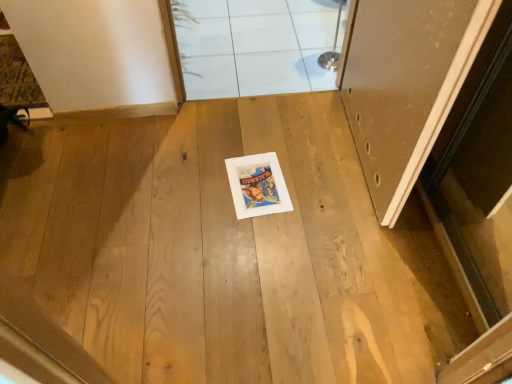
Describe the element at coordinates (406, 85) in the screenshot. I see `matte white door at right` at that location.

The width and height of the screenshot is (512, 384). I want to click on white tile at upper center, so click(254, 46).

In terms of height, does white tile at upper center look taller or shorter compared to white glossy tile at upper center?

white tile at upper center is shorter than white glossy tile at upper center.

From a real-world perspective, relative to white glossy tile at upper center, is white tile at upper center vertically above or below?

white tile at upper center is situated lower than white glossy tile at upper center in the real world.

Based on the photo, is white tile at upper center spatially inside white glossy tile at upper center, or outside of it?

white tile at upper center lies outside white glossy tile at upper center.

Which of these two, white tile at upper center or white glossy tile at upper center, is bigger?

With larger size is white tile at upper center.

Does point (325, 43) appear closer or farther from the camera than point (458, 84)?

Point (325, 43) is positioned farther from the camera compared to point (458, 84).

Based on the photo, does white glossy tile at upper center have a greater height compared to matte white door at right?

No, white glossy tile at upper center is not taller than matte white door at right.

Visually, is white glossy tile at upper center positioned to the left or to the right of matte white door at right?

Clearly, white glossy tile at upper center is on the left of matte white door at right in the image.

Could you tell me if white tile at upper center is facing matte white door at right?

No, white tile at upper center does not turn towards matte white door at right.

Which is correct: white tile at upper center is inside matte white door at right, or outside of it?

white tile at upper center is not inside matte white door at right, it's outside.

Between white tile at upper center and matte white door at right, which one appears on the right side from the viewer's perspective?

matte white door at right is more to the right.

Is white tile at upper center touching matte white door at right?

No, white tile at upper center is not making contact with matte white door at right.

How many degrees apart are the facing directions of matte white door at right and white glossy tile at upper center?

matte white door at right and white glossy tile at upper center are facing 4.18 degrees away from each other.

From the picture: From a real-world perspective, is matte white door at right positioned above or below white glossy tile at upper center?

From a real-world perspective, matte white door at right is physically above white glossy tile at upper center.

Which of these two, matte white door at right or white glossy tile at upper center, stands taller?

matte white door at right is taller.

Which object is positioned more to the right, matte white door at right or white tile at upper center?

matte white door at right.

Considering the positions of points (425, 28) and (270, 17), is point (425, 28) farther from camera compared to point (270, 17)?

No, (425, 28) is closer to viewer.

Can we say matte white door at right lies outside white tile at upper center?

Yes, matte white door at right is located beyond the bounds of white tile at upper center.

In terms of size, does white glossy tile at upper center appear bigger or smaller than white tile at upper center?

white glossy tile at upper center is smaller than white tile at upper center.

Can you tell me how much white glossy tile at upper center and white tile at upper center differ in facing direction?

92.4 degrees separate the facing orientations of white glossy tile at upper center and white tile at upper center.

Is white glossy tile at upper center touching white tile at upper center?

No, white glossy tile at upper center is not in contact with white tile at upper center.

Find the location of a particular element. This screenshot has width=512, height=384. window below the white glossy tile at upper center (from a real-world perspective) is located at coordinates (254, 46).

In the image, there is a white glossy tile at upper center. Where is `window below it (from the image's perspective)`? window below it (from the image's perspective) is located at coordinates (254, 46).

In order to click on tile that is under the matte white door at right (from a real-world perspective) in this screenshot , I will do `click(315, 29)`.

In the scene shown: Looking at the image, which one is located further to matte white door at right, white tile at upper center or white glossy tile at upper center?

The object further to matte white door at right is white glossy tile at upper center.

Estimate the real-world distances between objects in this image. Which object is closer to white tile at upper center, matte white door at right or white glossy tile at upper center?

white glossy tile at upper center is closer to white tile at upper center.

Based on their spatial positions, is white tile at upper center or matte white door at right further from white glossy tile at upper center?

Based on the image, matte white door at right appears to be further to white glossy tile at upper center.

Which object lies further to the anchor point white glossy tile at upper center, matte white door at right or white tile at upper center?

Based on the image, matte white door at right appears to be further to white glossy tile at upper center.

Which object lies nearer to the anchor point white tile at upper center, white glossy tile at upper center or matte white door at right?

white glossy tile at upper center is closer to white tile at upper center.

Which object lies further to the anchor point matte white door at right, white glossy tile at upper center or white tile at upper center?

white glossy tile at upper center lies further to matte white door at right than the other object.

This screenshot has height=384, width=512. In order to click on tile between matte white door at right and white tile at upper center from front to back in this screenshot , I will do `click(315, 29)`.